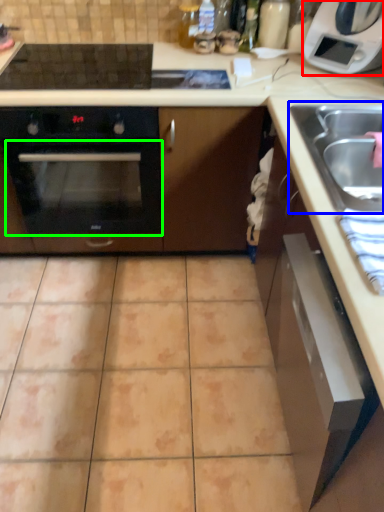
Question: Which is farther away from home appliance (highlighted by a red box)? sink (highlighted by a blue box) or oven (highlighted by a green box)?

Choices:
 (A) sink
 (B) oven

Answer: (B)